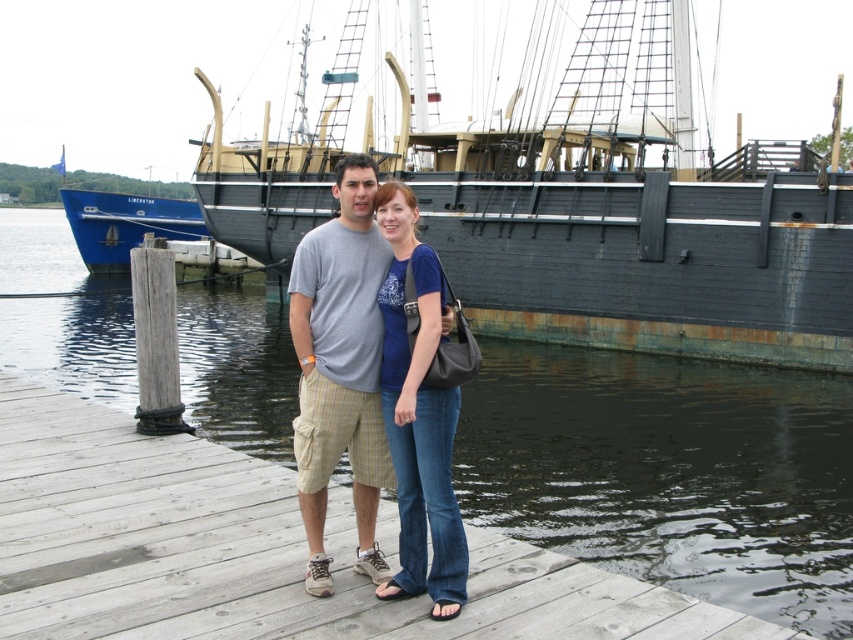
In the scene shown: Measure the distance between gray cotton t-shirt at center and camera.

gray cotton t-shirt at center is 21.56 feet from camera.

Looking at this image, between gray cotton t-shirt at center and blue jeans at center, which one has less height?

gray cotton t-shirt at center

Measure the distance between point [379,552] and camera.

A distance of 6.69 meters exists between point [379,552] and camera.

Find the location of a particular element. The height and width of the screenshot is (640, 853). gray cotton t-shirt at center is located at coordinates (340, 368).

Between dark water at dock center and rusty wooden ship at center, which one appears on the left side from the viewer's perspective?

dark water at dock center

Between dark water at dock center and rusty wooden ship at center, which one appears on the right side from the viewer's perspective?

rusty wooden ship at center

Does point (531, 394) lie in front of point (554, 177)?

That is True.

Where is `dark water at dock center`? The height and width of the screenshot is (640, 853). dark water at dock center is located at coordinates (669, 472).

Which is above, rusty wooden ship at center or gray cotton t-shirt at center?

Positioned higher is rusty wooden ship at center.

Does rusty wooden ship at center have a smaller size compared to gray cotton t-shirt at center?

No.

Where is `rusty wooden ship at center`? This screenshot has height=640, width=853. rusty wooden ship at center is located at coordinates tap(637, 216).

This screenshot has width=853, height=640. In order to click on rusty wooden ship at center in this screenshot , I will do `click(637, 216)`.